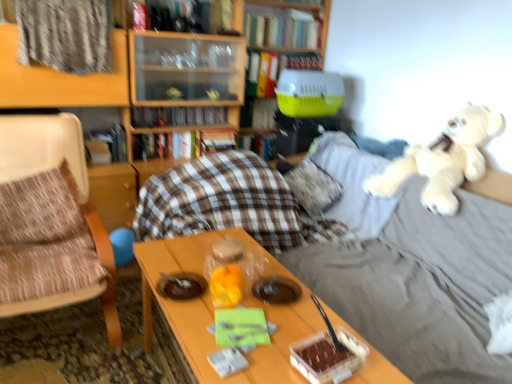
What do you see at coordinates (313, 187) in the screenshot?
I see `fluffy white pillow at center` at bounding box center [313, 187].

What do you see at coordinates (75, 90) in the screenshot? The image size is (512, 384). I see `wooden bookcase at upper center` at bounding box center [75, 90].

Measure the distance between point (291, 320) and camera.

They are 1.42 meters apart.

In order to face hardcover book at center, which is the seventh book in top-to-bottom order, should I rotate leftwards or rightwards?

It's best to rotate right around 0.351 degrees.

You are a GUI agent. You are given a task and a screenshot of the screen. Output one action in this format:
    pyautogui.click(x=<x>, y=<y>)
    Task: Click on the hardcover book at center, which is the seventh book in top-to-bottom order
    The width and height of the screenshot is (512, 384).
    Given the screenshot: What is the action you would take?
    pyautogui.click(x=259, y=144)

This screenshot has height=384, width=512. In order to click on green matte book at center, which appears as the fifth book when viewed from the top in this screenshot , I will do `click(258, 113)`.

Which object is thinner, green matte book at center, which appears as the fifth book when viewed from the top, or wooden bookcase at upper center?

Thinner between the two is green matte book at center, which appears as the fifth book when viewed from the top.

Based on the photo, considering their positions, is green matte book at center, which appears as the fifth book when viewed from the top, located in front of or behind wooden bookcase at upper center?

Clearly, green matte book at center, which appears as the fifth book when viewed from the top, is behind wooden bookcase at upper center.

Can you see green matte book at center, placed as the fourth book when sorted from bottom to top, touching wooden bookcase at upper center?

No, green matte book at center, placed as the fourth book when sorted from bottom to top, is not with wooden bookcase at upper center.

Is point (253, 124) farther from viewer compared to point (242, 8)?

Yes.

From the image's perspective, between hardcover book at center, the 6th book viewed from the top, and white plush at upper right, which one is located above?

hardcover book at center, the 6th book viewed from the top.

Measure the distance between hardcover book at center, placed as the 3th book when sorted from bottom to top, and white plush at upper right.

hardcover book at center, placed as the 3th book when sorted from bottom to top, is 1.54 meters from white plush at upper right.

Can you confirm if hardcover book at center, placed as the 3th book when sorted from bottom to top, is smaller than white plush at upper right?

Yes.

Does hardcover book at center, the 6th book viewed from the top, lie behind white plush at upper right?

Yes, hardcover book at center, the 6th book viewed from the top, is behind white plush at upper right.

Considering the sizes of objects hardcover book at center, which ranks as the sixth book in bottom-to-top order, and green matte book at center, which appears as the fifth book when viewed from the top, in the image provided, who is shorter, hardcover book at center, which ranks as the sixth book in bottom-to-top order, or green matte book at center, which appears as the fifth book when viewed from the top,?

green matte book at center, which appears as the fifth book when viewed from the top.

From a real-world perspective, is hardcover book at center, which ranks as the sixth book in bottom-to-top order, under green matte book at center, which appears as the fifth book when viewed from the top?

No, from a real-world perspective, hardcover book at center, which ranks as the sixth book in bottom-to-top order, is not below green matte book at center, which appears as the fifth book when viewed from the top.

Does hardcover book at center, the third book positioned from the top, have a smaller size compared to green matte book at center, which appears as the fifth book when viewed from the top?

Incorrect, hardcover book at center, the third book positioned from the top, is not smaller in size than green matte book at center, which appears as the fifth book when viewed from the top.

Considering the relative positions of hardcover book at center, the third book positioned from the top, and green matte book at center, which appears as the fifth book when viewed from the top, in the image provided, is hardcover book at center, the third book positioned from the top, to the left of green matte book at center, which appears as the fifth book when viewed from the top, from the viewer's perspective?

No.

Between hardcover book at upper center, the eighth book from the bottom, and hardcover book at center, the 6th book viewed from the top, which one has larger size?

hardcover book at upper center, the eighth book from the bottom.

Consider the image. Is hardcover book at upper center, acting as the 1th book starting from the top, outside of hardcover book at center, the 6th book viewed from the top?

Yes, hardcover book at upper center, acting as the 1th book starting from the top, is located beyond the bounds of hardcover book at center, the 6th book viewed from the top.

Considering the sizes of hardcover book at upper center, the eighth book from the bottom, and hardcover book at center, placed as the 3th book when sorted from bottom to top, in the image, is hardcover book at upper center, the eighth book from the bottom, taller or shorter than hardcover book at center, placed as the 3th book when sorted from bottom to top,?

Considering their sizes, hardcover book at upper center, the eighth book from the bottom, has more height than hardcover book at center, placed as the 3th book when sorted from bottom to top.

How different are the orientations of hardcover book at upper center, the eighth book from the bottom, and hardcover book at center, placed as the 3th book when sorted from bottom to top, in degrees?

They differ by 1.51 degrees in their facing directions.

How many degrees apart are the facing directions of green matte book at center, which appears as the fifth book when viewed from the top, and woven fabric chair at left?

The angle between the facing direction of green matte book at center, which appears as the fifth book when viewed from the top, and the facing direction of woven fabric chair at left is 1.82 degrees.

From a real-world perspective, starting from the woven fabric chair at left, which book is the 4th one vertically above it? Please provide its 2D coordinates.

[(258, 113)]

Is point (265, 102) closer or farther from the camera than point (111, 273)?

Clearly, point (265, 102) is more distant from the camera than point (111, 273).

Does green matte book at center, placed as the fourth book when sorted from bottom to top, have a greater height compared to woven fabric chair at left?

Incorrect, the height of green matte book at center, placed as the fourth book when sorted from bottom to top, is not larger of that of woven fabric chair at left.

Are hardcover book at upper center, the eighth book from the bottom, and yellow plastic pet carrier at center located far from each other?

No.

Does hardcover book at upper center, the eighth book from the bottom, have a smaller size compared to yellow plastic pet carrier at center?

Yes, hardcover book at upper center, the eighth book from the bottom, is smaller than yellow plastic pet carrier at center.

Which object is wider, hardcover book at upper center, acting as the 1th book starting from the top, or yellow plastic pet carrier at center?

With larger width is yellow plastic pet carrier at center.

Relative to hardcover book at center, the 6th book viewed from the top, is green matte book at center, which appears as the fifth book when viewed from the top, in front or behind?

green matte book at center, which appears as the fifth book when viewed from the top, is behind hardcover book at center, the 6th book viewed from the top.

From the image's perspective, is green matte book at center, placed as the fourth book when sorted from bottom to top, positioned above or below hardcover book at center, the 6th book viewed from the top?

Based on their image positions, green matte book at center, placed as the fourth book when sorted from bottom to top, is located above hardcover book at center, the 6th book viewed from the top.

Is green matte book at center, which appears as the fifth book when viewed from the top, completely or partially outside of hardcover book at center, placed as the 3th book when sorted from bottom to top?

Yes, green matte book at center, which appears as the fifth book when viewed from the top, is located beyond the bounds of hardcover book at center, placed as the 3th book when sorted from bottom to top.

Identify the location of bookcase lying below the green matte book at center, placed as the fourth book when sorted from bottom to top (from the image's perspective). The height and width of the screenshot is (384, 512). (75, 90).

Where is `the 3rd book above the white plush at upper right (from the image's perspective)`? the 3rd book above the white plush at upper right (from the image's perspective) is located at coordinates (x=178, y=116).

Estimate the real-world distances between objects in this image. Which object is further from hardcover book at center, the 6th book viewed from the top, plaid fabric at upper left or wooden table at center?

wooden table at center is further to hardcover book at center, the 6th book viewed from the top.

Based on their spatial positions, is metallic silver book at upper center, the 2th book positioned from the top, or hardcover book at upper center, the eighth book from the bottom, further from hardcover book at center, placed as the 3th book when sorted from bottom to top?

hardcover book at upper center, the eighth book from the bottom, is positioned further to the anchor hardcover book at center, placed as the 3th book when sorted from bottom to top.

From the picture: Estimate the real-world distances between objects in this image. Which object is closer to green matte book at center, placed as the fourth book when sorted from bottom to top, plaid fabric at upper left or white plush at upper right?

plaid fabric at upper left.

Looking at the image, which one is located closer to white plush at upper right, hardcover book at center, which is counted as the 8th book, starting from the top, or hardcover book at center, placed as the 3th book when sorted from bottom to top?

hardcover book at center, which is counted as the 8th book, starting from the top, is closer to white plush at upper right.

When comparing their distances from woven fabric chair at left, does hardcover book at upper center, acting as the 1th book starting from the top, or wooden bookcase at upper center seem further?

Based on the image, hardcover book at upper center, acting as the 1th book starting from the top, appears to be further to woven fabric chair at left.

Based on their spatial positions, is hardcover book at upper center, the eighth book from the bottom, or hardcover book at center, which is the 2th book from bottom to top, closer to wooden bookcase at upper center?

hardcover book at center, which is the 2th book from bottom to top, is closer to wooden bookcase at upper center.

From the picture: From the image, which object appears to be nearer to green matte book at center, the fourth book when ordered from top to bottom, fluffy white pillow at center or hardcover book at center, which is the 1th book from bottom to top?

hardcover book at center, which is the 1th book from bottom to top, is positioned closer to the anchor green matte book at center, the fourth book when ordered from top to bottom.

Which object lies further to the anchor point yellow plastic pet carrier at center, fluffy white pillow at center or hardcover book at center, which is the 2th book from bottom to top?

Based on the image, fluffy white pillow at center appears to be further to yellow plastic pet carrier at center.

Find the location of a particular element. This screenshot has width=512, height=384. plaid located between wooden bookcase at upper center and green matte book at center, which appears as the fifth book when viewed from the top, in the depth direction is located at coordinates (64, 35).

This screenshot has width=512, height=384. Find the location of `bookcase between wooden table at center and hardcover book at center, which is the seventh book in top-to-bottom order, in the front-back direction`. bookcase between wooden table at center and hardcover book at center, which is the seventh book in top-to-bottom order, in the front-back direction is located at coordinates (75, 90).

Where is `plaid located between wooden table at center and hardcover book at center, the 6th book viewed from the top, in the depth direction`? Image resolution: width=512 pixels, height=384 pixels. plaid located between wooden table at center and hardcover book at center, the 6th book viewed from the top, in the depth direction is located at coordinates (64, 35).

Locate an element on the screen. Image resolution: width=512 pixels, height=384 pixels. pillow between white plush at upper right and green matte book at center, which is the 5th book in bottom-to-top order, in the front-back direction is located at coordinates (313, 187).